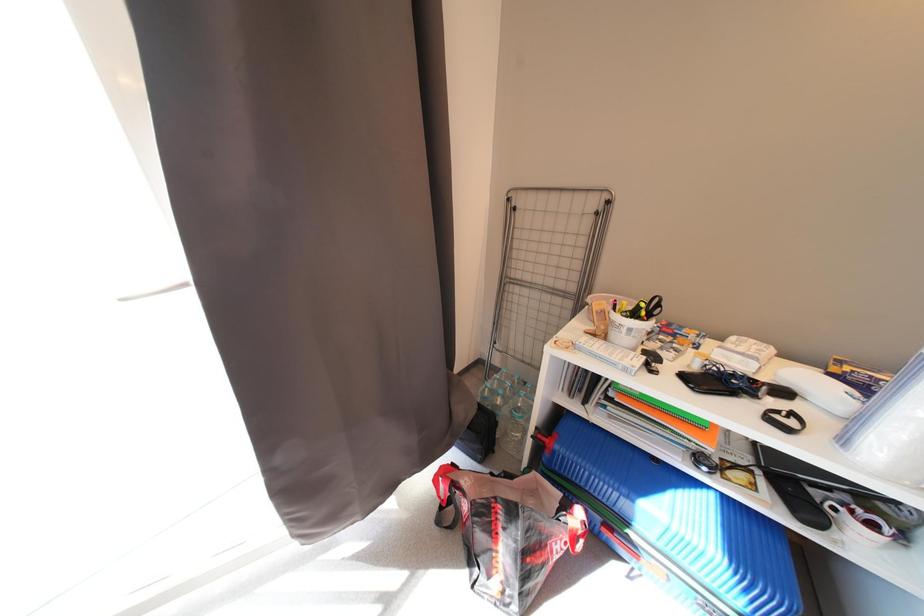
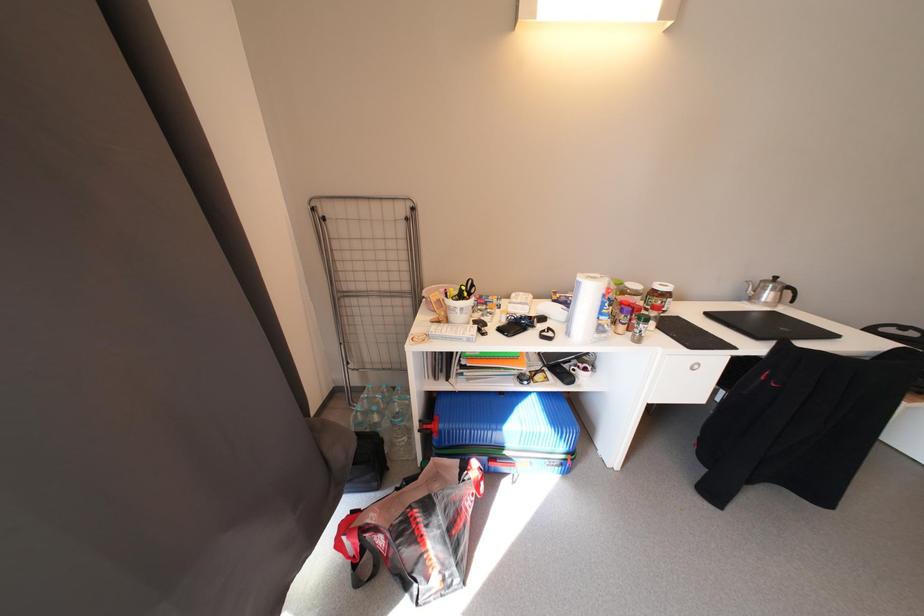
Question: The images are taken continuously from a first-person perspective. In which direction is your viewpoint rotating?

Choices:
 (A) Left
 (B) Right
 (C) Up
 (D) Down

Answer: (B)